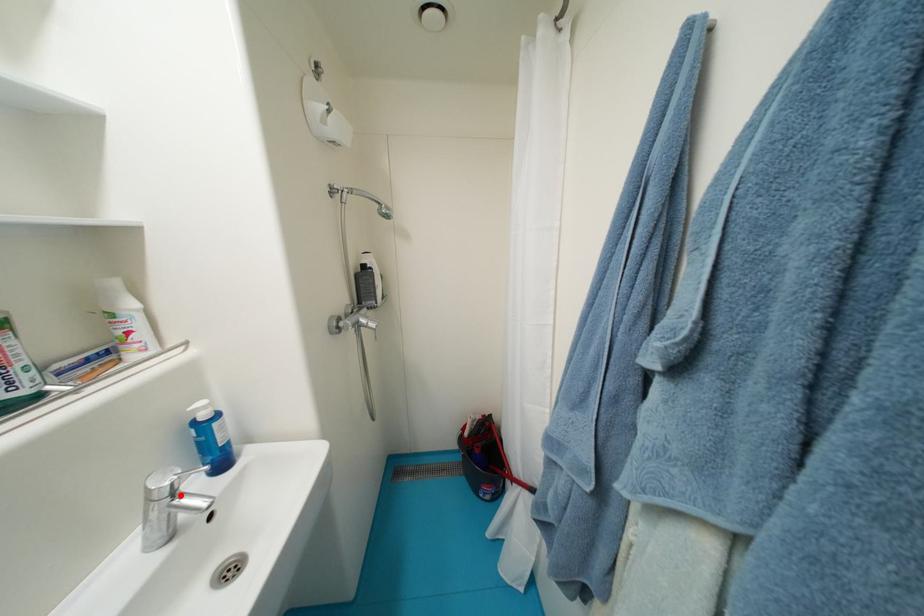
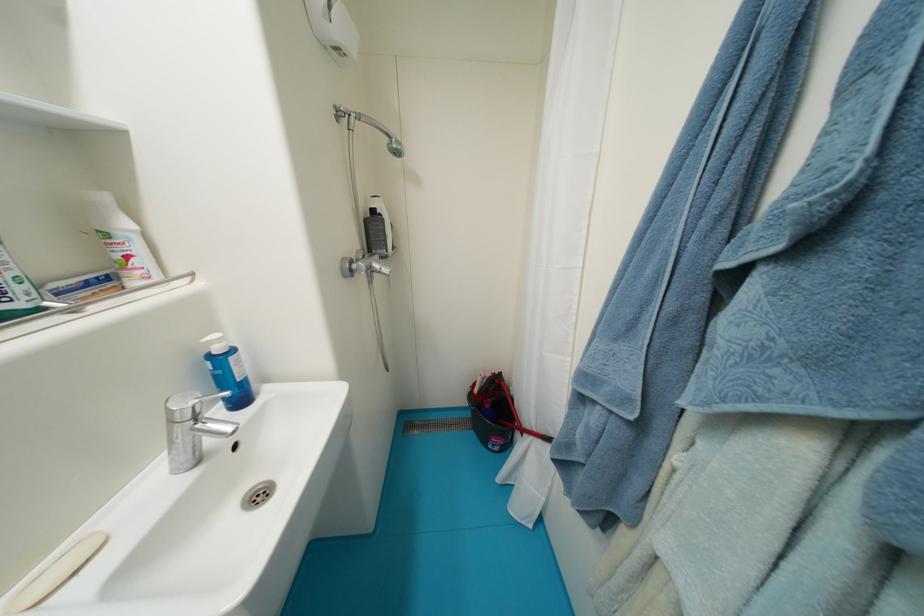
Where in the second image is the point corresponding to the highlighted location from the first image?

(203, 419)